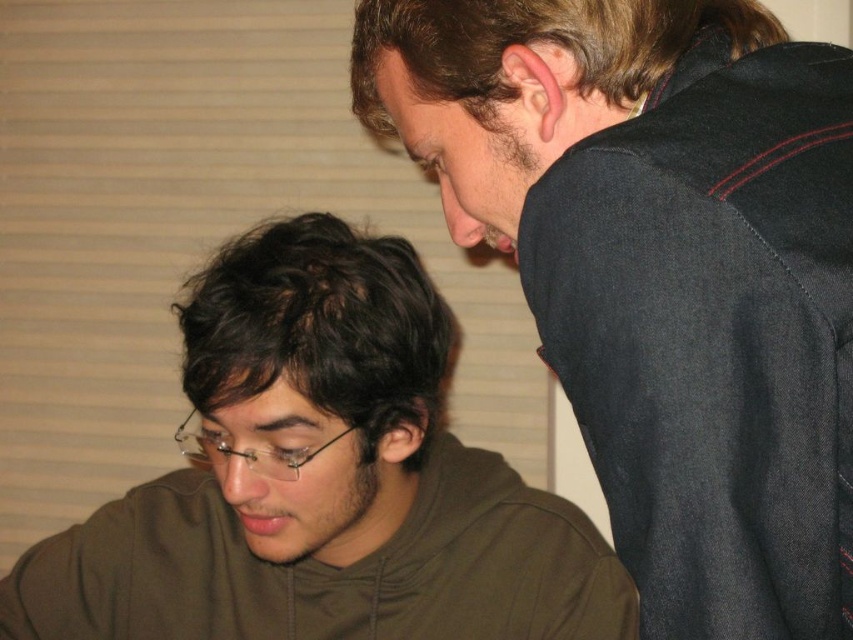
You are a photographer setting up a shoot in this scene. You need to position a light source to the left of both the dark gray fabric at upper right and the brown matte hoodie at lower left. Is this possible given their positions?

The dark gray fabric at upper right is to the right of the brown matte hoodie at lower left, so positioning a light source to the left of both would be possible as they are arranged horizontally with space between them.

You are standing in the room and see two points marked in the image. Which point is closer to you, point (790, 468) or point (381, 552)?

Point (790, 468) is in front of point (381, 552), so it is closer to you.

You are a photographer setting up a shoot in this scene. You need to position a spotlight so that it illuminates the dark gray fabric at upper right and the brown matte hoodie at lower left without causing glare on any reflective surfaces. Given their positions, which object should you aim the spotlight at first to ensure proper lighting?

The dark gray fabric at upper right should be lit first since it is positioned above the brown matte hoodie at lower left, allowing the light to naturally cascade downward and illuminate both areas effectively without glare.